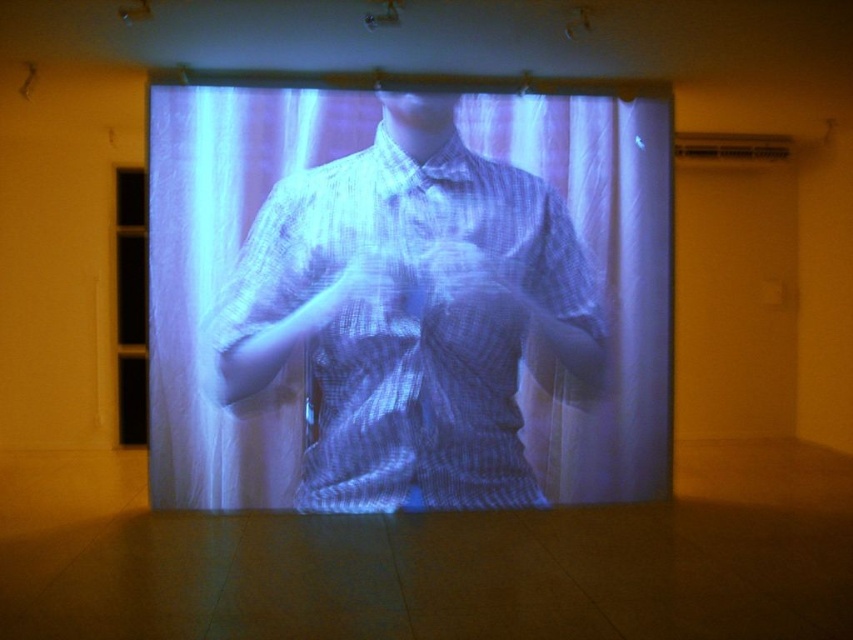
Question: Which point is farther from the camera taking this photo?

Choices:
 (A) (380, 298)
 (B) (355, 244)

Answer: (B)

Question: Is translucent white shirt at center below translucent fabric hand at center?

Choices:
 (A) yes
 (B) no

Answer: (A)

Question: From the image, what is the correct spatial relationship of translucent white shirt at center in relation to translucent fabric hand at center?

Choices:
 (A) below
 (B) above

Answer: (A)

Question: Which point is farther to the camera?

Choices:
 (A) translucent fabric hand at center
 (B) translucent white shirt at center

Answer: (A)

Question: Does translucent white shirt at center have a smaller size compared to translucent fabric hand at center?

Choices:
 (A) no
 (B) yes

Answer: (A)